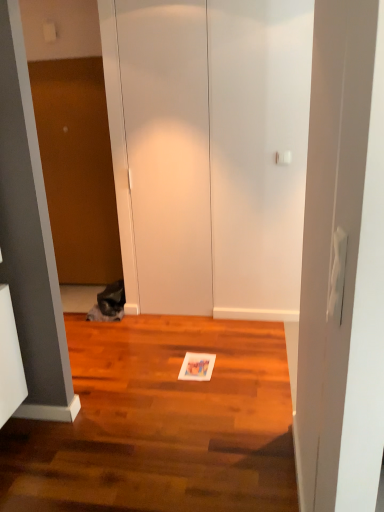
Locate an element on the screen. Image resolution: width=384 pixels, height=512 pixels. free space in front of white matte door at center is located at coordinates (176, 334).